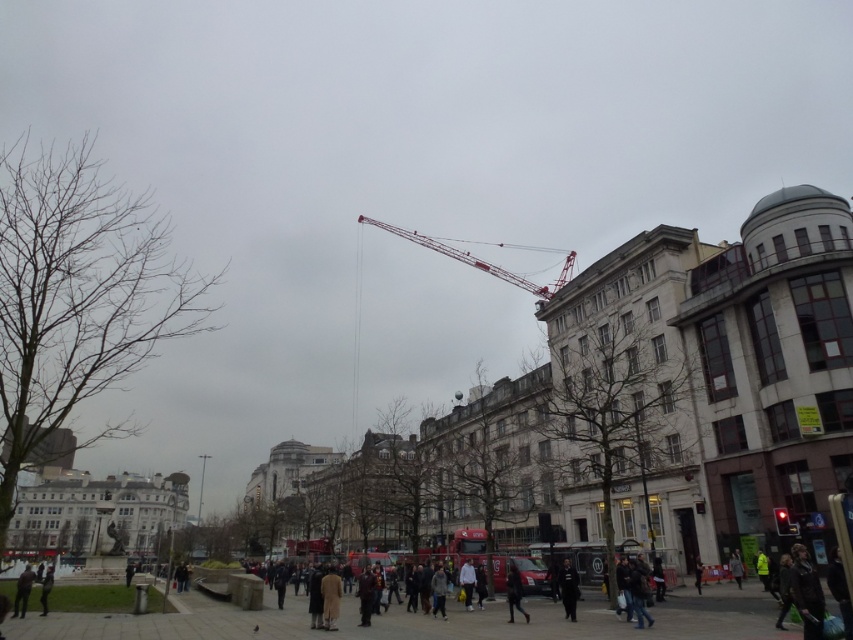
Question: Is metallic red crane at upper center wider than dark gray jacket at lower left?

Choices:
 (A) yes
 (B) no

Answer: (A)

Question: Is metallic red crane at upper center thinner than dark gray jacket at lower left?

Choices:
 (A) no
 (B) yes

Answer: (A)

Question: Can you confirm if metallic red crane at upper center is positioned below dark gray jacket at lower left?

Choices:
 (A) yes
 (B) no

Answer: (B)

Question: Which object is closer to the camera taking this photo?

Choices:
 (A) metallic red crane at upper center
 (B) dark gray jacket at lower left

Answer: (B)

Question: Which object appears closest to the camera in this image?

Choices:
 (A) metallic red crane at upper center
 (B) dark gray jacket at lower left

Answer: (B)